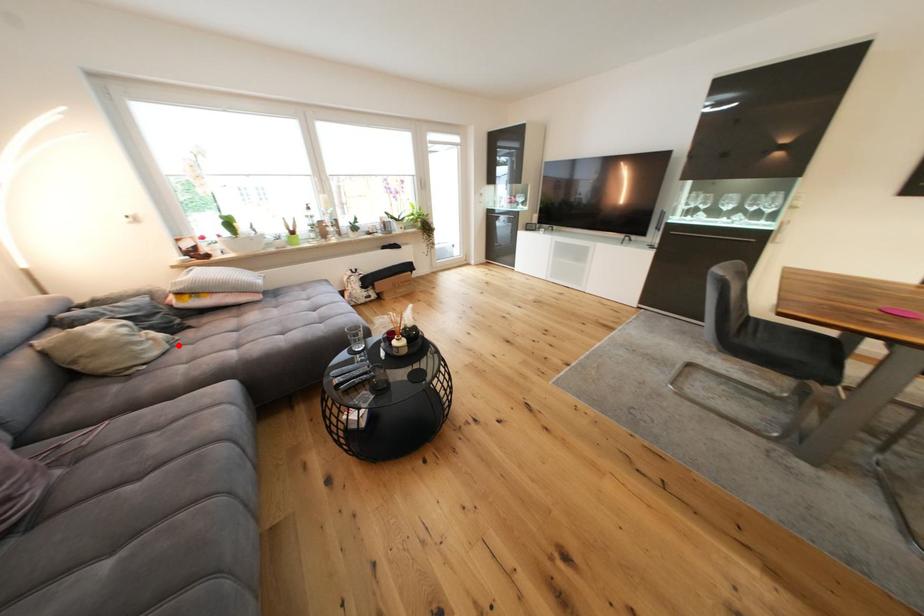
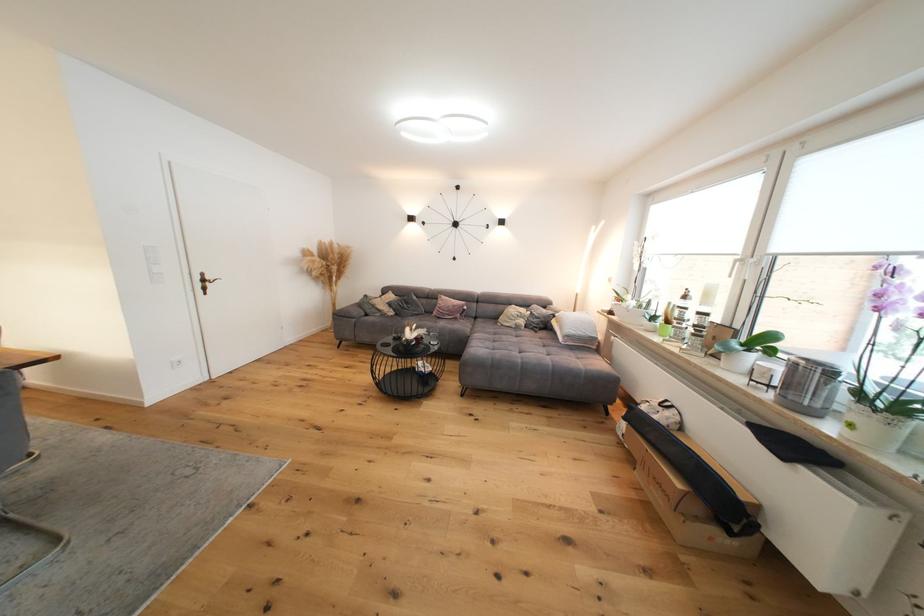
Locate, in the second image, the point that corresponds to the highlighted location in the first image.

(524, 330)